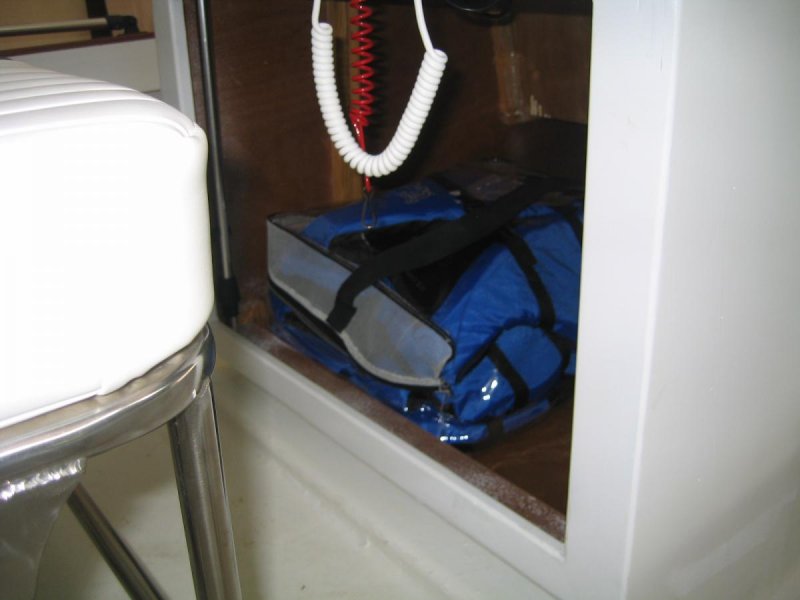
The image size is (800, 600). In order to click on floor in this screenshot , I will do `click(298, 548)`.